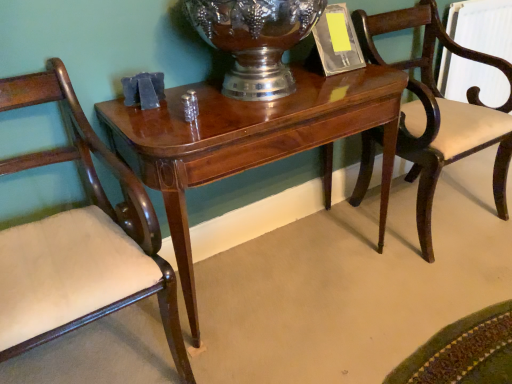
Where is `vacant area that lies between shiny wood table at center and mahogany wood chair at right, the first chair when ordered from right to left`? vacant area that lies between shiny wood table at center and mahogany wood chair at right, the first chair when ordered from right to left is located at coordinates (348, 282).